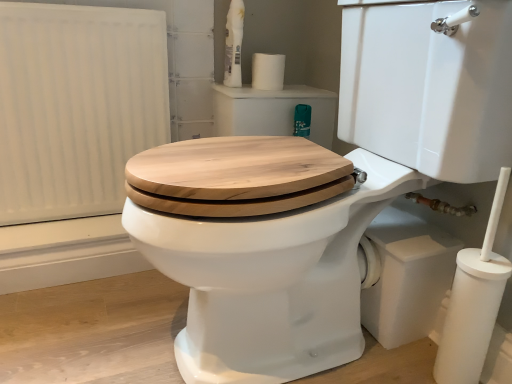
Question: Is white glossy spray bottle at upper center facing towards white matte toilet paper at upper center?

Choices:
 (A) no
 (B) yes

Answer: (A)

Question: Considering the relative positions of white glossy spray bottle at upper center and white matte toilet paper at upper center in the image provided, is white glossy spray bottle at upper center behind white matte toilet paper at upper center?

Choices:
 (A) yes
 (B) no

Answer: (B)

Question: From a real-world perspective, is white glossy spray bottle at upper center located higher than white matte toilet paper at upper center?

Choices:
 (A) no
 (B) yes

Answer: (B)

Question: From a real-world perspective, is white glossy spray bottle at upper center under white matte toilet paper at upper center?

Choices:
 (A) yes
 (B) no

Answer: (B)

Question: Is white glossy spray bottle at upper center thinner than white matte toilet paper at upper center?

Choices:
 (A) yes
 (B) no

Answer: (A)

Question: From the image's perspective, does white glossy spray bottle at upper center appear lower than white matte toilet paper at upper center?

Choices:
 (A) yes
 (B) no

Answer: (B)

Question: Would you say white matte radiator at left is outside white matte toilet paper at upper center?

Choices:
 (A) yes
 (B) no

Answer: (A)

Question: Is white matte radiator at left shorter than white matte toilet paper at upper center?

Choices:
 (A) no
 (B) yes

Answer: (A)

Question: Is white matte radiator at left oriented towards white matte toilet paper at upper center?

Choices:
 (A) yes
 (B) no

Answer: (B)

Question: From a real-world perspective, is white matte radiator at left positioned over white matte toilet paper at upper center based on gravity?

Choices:
 (A) no
 (B) yes

Answer: (A)

Question: Is white matte radiator at left oriented away from white matte toilet paper at upper center?

Choices:
 (A) no
 (B) yes

Answer: (A)

Question: Are white matte radiator at left and white matte toilet paper at upper center located far from each other?

Choices:
 (A) yes
 (B) no

Answer: (B)

Question: Does white matte toilet paper at lower right have a lesser height compared to white glossy spray bottle at upper center?

Choices:
 (A) yes
 (B) no

Answer: (A)